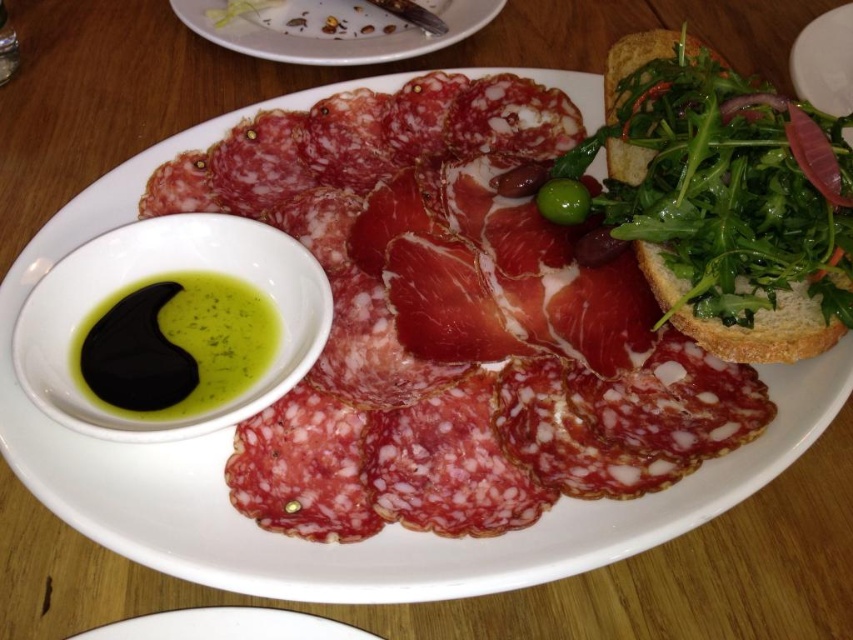
You are at a picnic and need to grab the green leafy salad at upper right to make a quick snack. However, you have a small plate in your hand. Is the black oil at lower left blocking your path to the salad?

The black oil at lower left is to the left of the green leafy salad at upper right, so it is not blocking your path to the salad. You can reach the salad without moving the oil.

You are looking at the charcuterie setup. Where exactly is the white ceramic plate at upper center located in terms of coordinates?

The white ceramic plate at upper center is located at coordinates point (328, 28).

You are a chef arranging a charcuterie board and need to place both the white ceramic plate at upper center and the green glossy olive at upper center. Based on their sizes, which one should you place first to ensure proper positioning?

The white ceramic plate at upper center is much taller than the green glossy olive at upper center, so you should place the white ceramic plate at upper center first to ensure it has enough space and stability before placing the smaller olive.